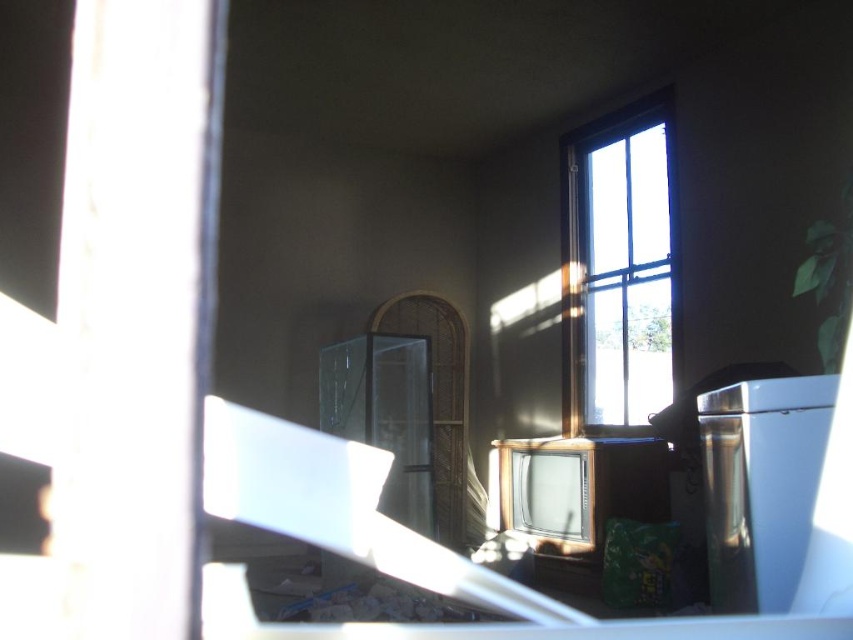
You are a delivery person trying to place a large package that is 2 meters long in this room. You want to position it between the clear glass window at upper right and the satin silver trash can at right. Is there enough space for the package to fit horizontally between them?

The distance between the clear glass window at upper right and the satin silver trash can at right is 2.64 meters. Since the package is 2 meters long, there is sufficient space for it to fit horizontally between them.

You are standing in the room and want to throw away a piece of paper. You see the clear glass window at upper right and the satin silver trash can at right. Which object is closer to you so you can reach it easily?

The satin silver trash can at right is closer to you than the clear glass window at upper right, so you can reach it easily.